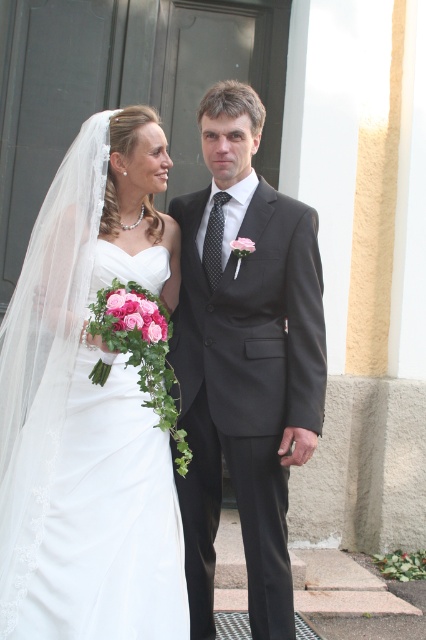
Question: Does white satin dress at left have a larger size compared to matte black suit at center?

Choices:
 (A) no
 (B) yes

Answer: (B)

Question: Can you confirm if white satin dress at left is positioned to the left of matte black suit at center?

Choices:
 (A) no
 (B) yes

Answer: (B)

Question: Among these points, which one is farthest from the camera?

Choices:
 (A) (89, 616)
 (B) (270, 323)

Answer: (B)

Question: Which of the following is the closest to the observer?

Choices:
 (A) matte black suit at center
 (B) white satin dress at left

Answer: (B)

Question: Among these points, which one is nearest to the camera?

Choices:
 (A) (313, 275)
 (B) (48, 349)

Answer: (A)

Question: Is white satin dress at left bigger than matte black suit at center?

Choices:
 (A) no
 (B) yes

Answer: (B)